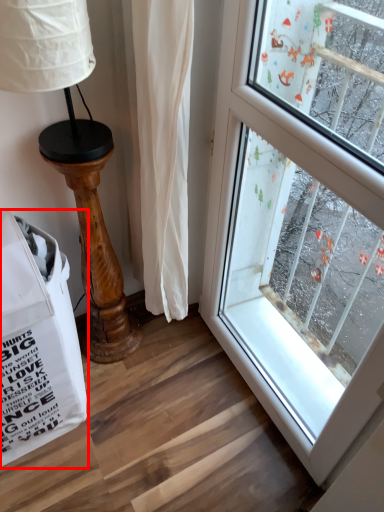
Question: From the image, what is the correct spatial relationship of grocery bag (annotated by the red box) in relation to table lamp?

Choices:
 (A) right
 (B) left

Answer: (B)